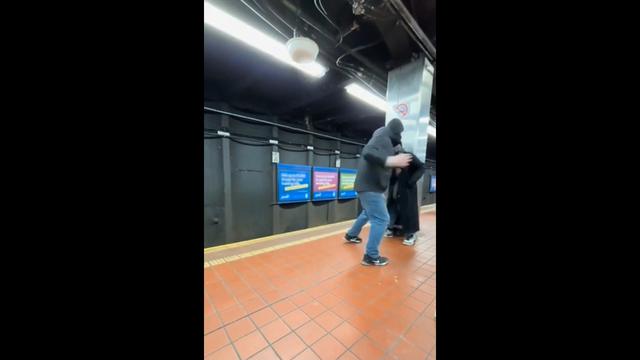
Where is `ceiling light`? The width and height of the screenshot is (640, 360). ceiling light is located at coordinates (262, 45).